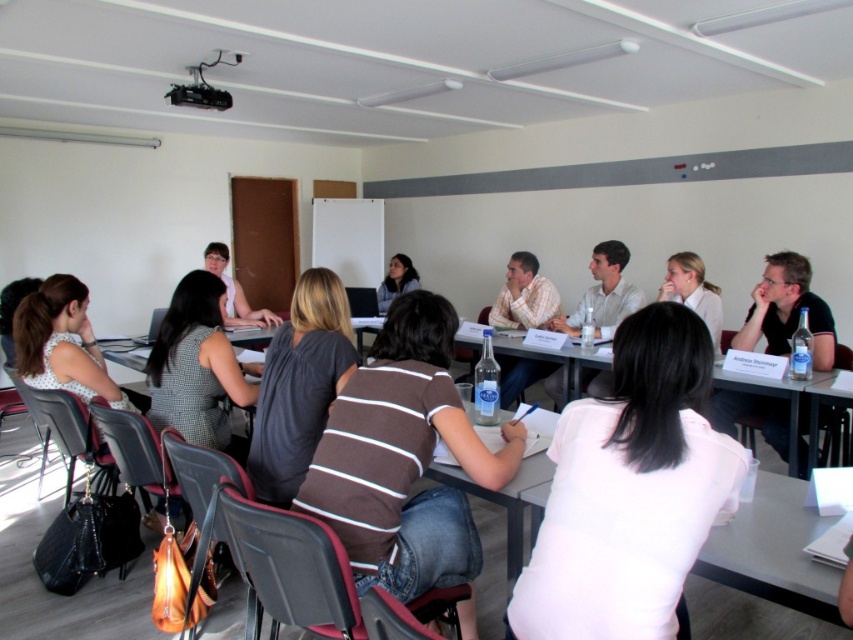
Question: Based on their relative distances, which object is nearer to the pink cotton shirt at center?

Choices:
 (A) light beige shirt at center
 (B) matte black shirt at center
 (C) black matte shirt at right

Answer: (C)

Question: Does pink cotton shirt at center appear on the right side of light beige shirt at center?

Choices:
 (A) yes
 (B) no

Answer: (B)

Question: Which point appears closest to the camera in this image?

Choices:
 (A) (532, 460)
 (B) (589, 266)

Answer: (A)

Question: Does pink cotton shirt at center have a greater width compared to dark gray fabric shirt at center?

Choices:
 (A) yes
 (B) no

Answer: (A)

Question: Does dark gray fabric shirt at center appear on the right side of light beige shirt at center?

Choices:
 (A) no
 (B) yes

Answer: (A)

Question: Which object is farther from the camera taking this photo?

Choices:
 (A) black matte shirt at right
 (B) pink cotton shirt at center
 (C) light beige shirt at center

Answer: (C)